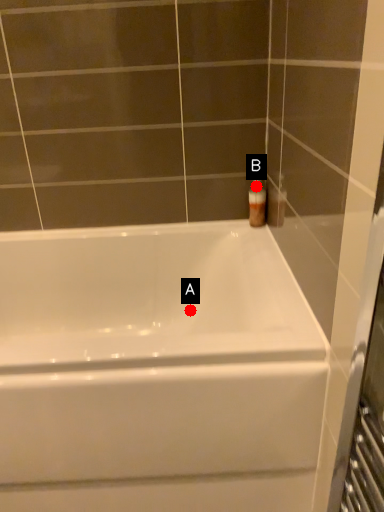
Question: Two points are circled on the image, labeled by A and B beside each circle. Which point is closer to the camera?

Choices:
 (A) A is closer
 (B) B is closer

Answer: (B)